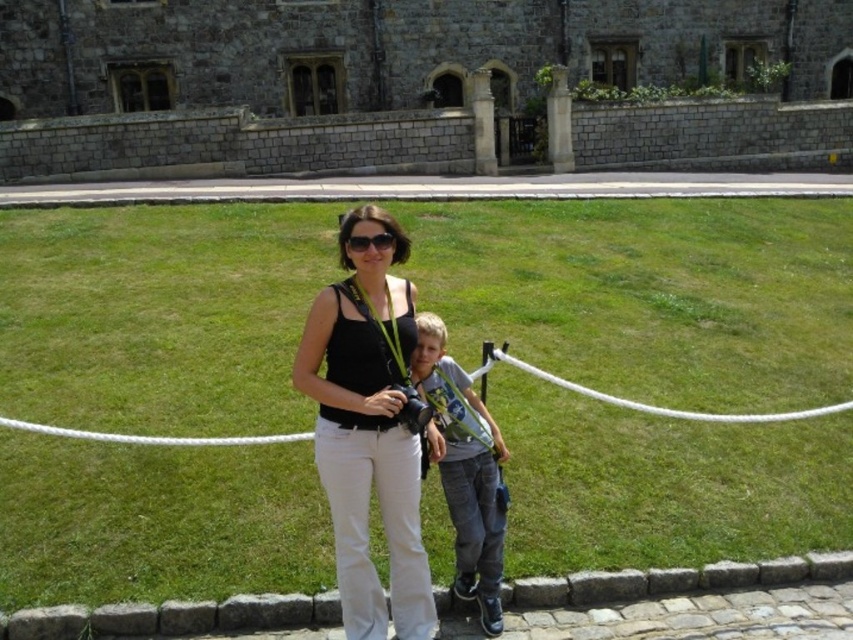
Question: Among these points, which one is nearest to the camera?

Choices:
 (A) (462, 384)
 (B) (347, 244)

Answer: (B)

Question: Which point appears closest to the camera in this image?

Choices:
 (A) (352, 618)
 (B) (444, 442)
 (C) (556, 243)

Answer: (A)

Question: Does green grass at center appear on the left side of black plastic sunglasses at center?

Choices:
 (A) no
 (B) yes

Answer: (A)

Question: Is black matte tank top at center thinner than blue denim jeans at center?

Choices:
 (A) no
 (B) yes

Answer: (A)

Question: Is blue denim jeans at center above black plastic sunglasses at center?

Choices:
 (A) yes
 (B) no

Answer: (B)

Question: Which of the following is the closest to the observer?

Choices:
 (A) green grass at center
 (B) black matte tank top at center
 (C) black plastic sunglasses at center

Answer: (B)